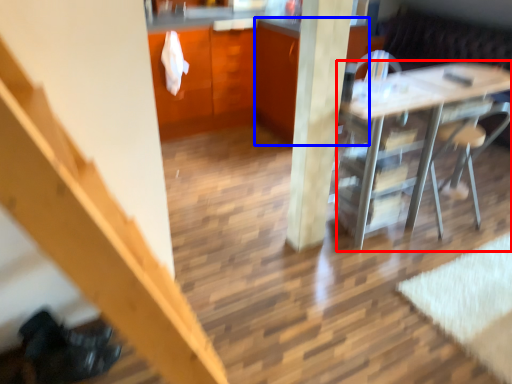
Question: Which point is closer to the camera, desk (highlighted by a red box) or cabinetry (highlighted by a blue box)?

Choices:
 (A) desk
 (B) cabinetry

Answer: (A)